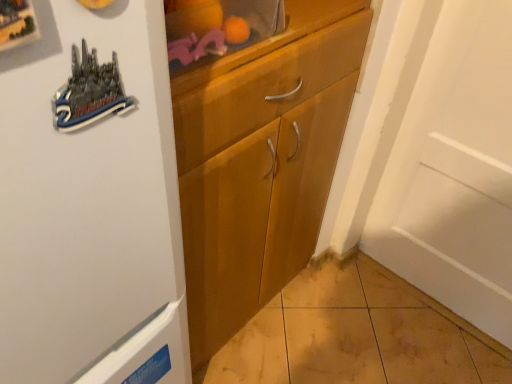
Find the location of `wooden cabinet at upper center`. wooden cabinet at upper center is located at coordinates (217, 28).

Describe the element at coordinates (217, 28) in the screenshot. I see `wooden cabinet at upper center` at that location.

What do you see at coordinates (261, 161) in the screenshot?
I see `wooden cabinet at center` at bounding box center [261, 161].

Locate an element on the screen. wooden cabinet at center is located at coordinates (261, 161).

Find the location of a particular element. The image size is (512, 384). wooden cabinet at upper center is located at coordinates (217, 28).

Considering the relative positions of wooden cabinet at upper center and wooden cabinet at center in the image provided, is wooden cabinet at upper center to the left of wooden cabinet at center from the viewer's perspective?

In fact, wooden cabinet at upper center is to the right of wooden cabinet at center.

Is wooden cabinet at upper center closer to camera compared to wooden cabinet at center?

Yes.

Considering the points (200, 34) and (266, 112), which point is behind, point (200, 34) or point (266, 112)?

The point (266, 112) is farther from the camera.

From the image's perspective, relative to wooden cabinet at center, is wooden cabinet at upper center above or below?

wooden cabinet at upper center is situated higher than wooden cabinet at center in the image.

From a real-world perspective, is wooden cabinet at upper center physically above wooden cabinet at center?

Yes, from a real-world perspective, wooden cabinet at upper center is above wooden cabinet at center.

From the picture: Between wooden cabinet at upper center and wooden cabinet at center, which one has smaller width?

With smaller width is wooden cabinet at upper center.

Consider the image. Does wooden cabinet at upper center have a lesser height compared to wooden cabinet at center?

Indeed, wooden cabinet at upper center has a lesser height compared to wooden cabinet at center.

Is wooden cabinet at upper center smaller than wooden cabinet at center?

Yes.

Is wooden cabinet at upper center surrounding wooden cabinet at center?

No, wooden cabinet at upper center does not contain wooden cabinet at center.

Are wooden cabinet at upper center and wooden cabinet at center far apart?

No, there isn't a large distance between wooden cabinet at upper center and wooden cabinet at center.

Is wooden cabinet at upper center turned away from wooden cabinet at center?

No, wooden cabinet at center is not at the back of wooden cabinet at upper center.

What's the angular difference between wooden cabinet at upper center and wooden cabinet at center's facing directions?

4.08 degrees separate the facing orientations of wooden cabinet at upper center and wooden cabinet at center.

How much distance is there between wooden cabinet at upper center and wooden cabinet at center?

wooden cabinet at upper center is 11.28 inches away from wooden cabinet at center.

This screenshot has width=512, height=384. In order to click on cabinetry behind the wooden cabinet at upper center in this screenshot , I will do `click(261, 161)`.

Is wooden cabinet at center at the right side of wooden cabinet at upper center?

No.

Does wooden cabinet at center lie in front of wooden cabinet at upper center?

No, wooden cabinet at center is behind wooden cabinet at upper center.

Considering the positions of point (258, 251) and point (185, 67), is point (258, 251) closer or farther from the camera than point (185, 67)?

Point (258, 251) appears to be farther away from the viewer than point (185, 67).

From the image's perspective, is wooden cabinet at center located above or below wooden cabinet at upper center?

Based on their image positions, wooden cabinet at center is located beneath wooden cabinet at upper center.

From a real-world perspective, is wooden cabinet at center located beneath wooden cabinet at upper center?

Indeed, from a real-world perspective, wooden cabinet at center is positioned beneath wooden cabinet at upper center.

Which of these two, wooden cabinet at center or wooden cabinet at upper center, is thinner?

wooden cabinet at upper center.

Between wooden cabinet at center and wooden cabinet at upper center, which one has less height?

Standing shorter between the two is wooden cabinet at upper center.

Is wooden cabinet at center smaller than wooden cabinet at upper center?

Incorrect, wooden cabinet at center is not smaller in size than wooden cabinet at upper center.

Can we say wooden cabinet at center lies outside wooden cabinet at upper center?

Indeed, wooden cabinet at center is completely outside wooden cabinet at upper center.

Is wooden cabinet at center next to wooden cabinet at upper center?

wooden cabinet at center and wooden cabinet at upper center are clearly separated.

Could you tell me if wooden cabinet at center is facing wooden cabinet at upper center?

No, wooden cabinet at center is not aimed at wooden cabinet at upper center.

At what (x,y) coordinates should I click in order to perform the action: click on cabinetry located below the wooden cabinet at upper center (from the image's perspective). Please return your answer as a coordinate pair (x, y). The height and width of the screenshot is (384, 512). Looking at the image, I should click on (261, 161).

I want to click on cabinetry lying on the left of wooden cabinet at upper center, so click(261, 161).

At what (x,y) coordinates should I click in order to perform the action: click on cabinetry below the wooden cabinet at upper center (from a real-world perspective). Please return your answer as a coordinate pair (x, y). This screenshot has height=384, width=512. Looking at the image, I should click on (261, 161).